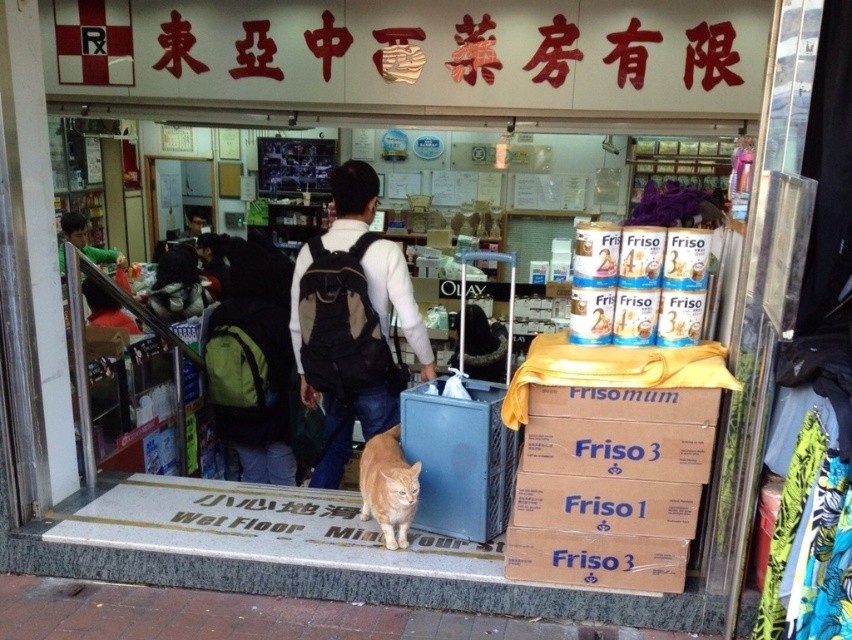
Question: Which object is positioned closest to the dark brown backpack at center?

Choices:
 (A) white paper sign at center
 (B) green fabric shirt at upper left
 (C) matte black backpack at center

Answer: (A)

Question: Does white paper sign at center appear under orange fur cat at center?

Choices:
 (A) no
 (B) yes

Answer: (B)

Question: Does blue plastic crate at center have a greater width compared to orange fur cat at center?

Choices:
 (A) no
 (B) yes

Answer: (B)

Question: Is brown cardboard box at right closer to camera compared to dark brown backpack at center?

Choices:
 (A) no
 (B) yes

Answer: (B)

Question: Which of the following is the farthest from the observer?

Choices:
 (A) green fabric shirt at upper left
 (B) dark brown backpack at center
 (C) blue plastic crate at center
 (D) brown cardboard box at right

Answer: (A)

Question: Which point is closer to the camera?

Choices:
 (A) blue plastic crate at center
 (B) dark brown backpack at center
 (C) brown cardboard box at right

Answer: (C)